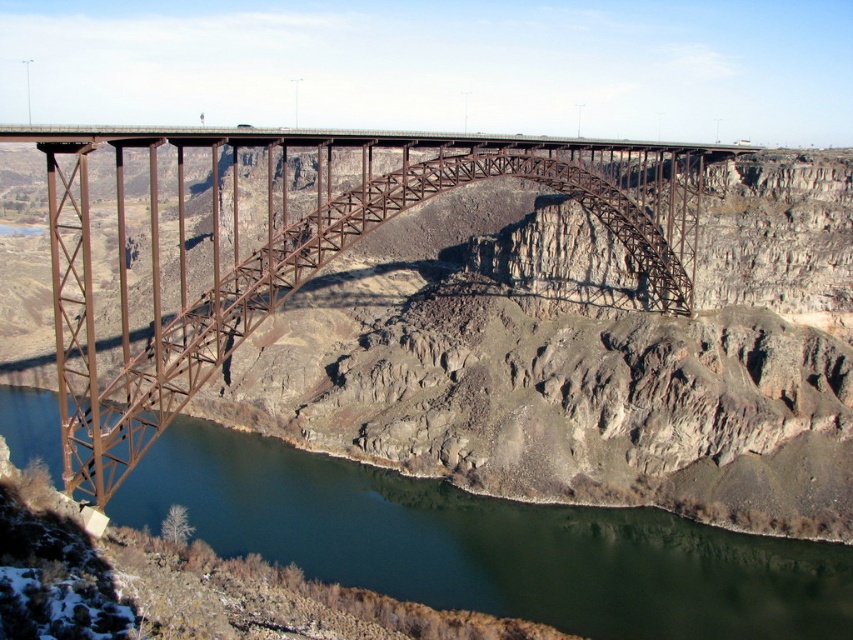
Does point (200, 340) come behind point (608, 573)?

No, (200, 340) is closer to viewer.

Between point (380, 177) and point (178, 456), which one is positioned behind?

Point (178, 456)

Describe the element at coordinates (281, 244) in the screenshot. This screenshot has height=640, width=853. I see `rusty metal bridge at center` at that location.

This screenshot has width=853, height=640. What are the coordinates of `rusty metal bridge at center` in the screenshot? It's located at (281, 244).